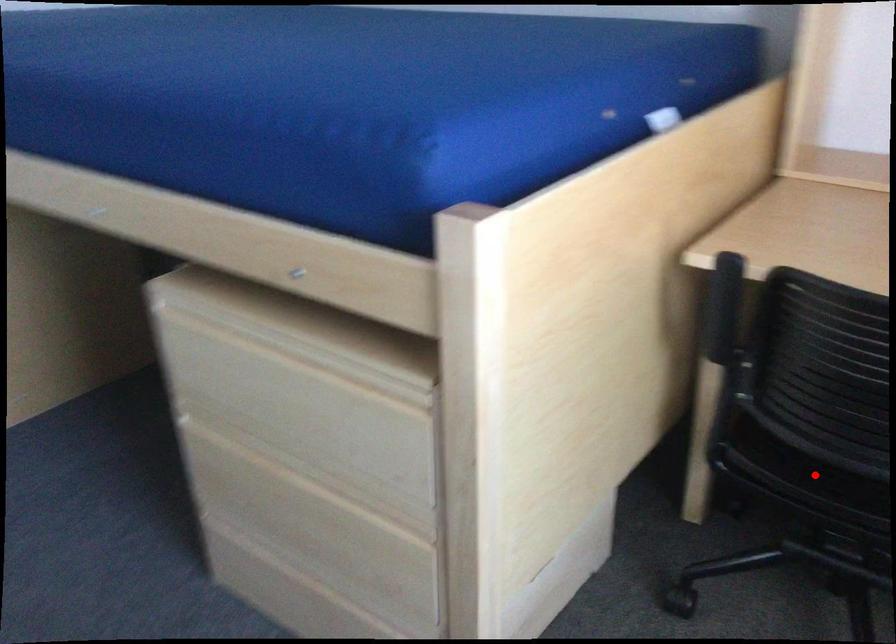
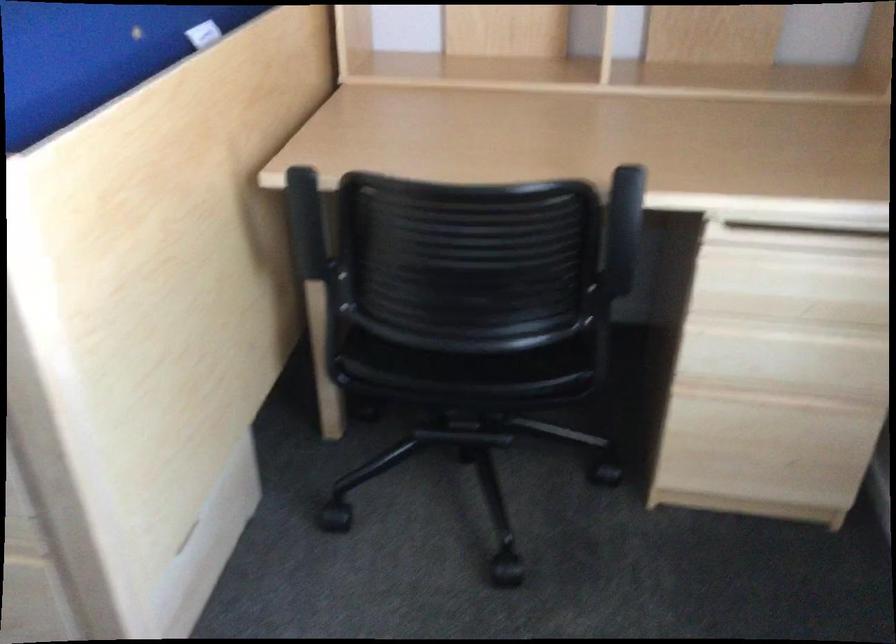
In the second image, find the point that corresponds to the highlighted location in the first image.

(433, 361)